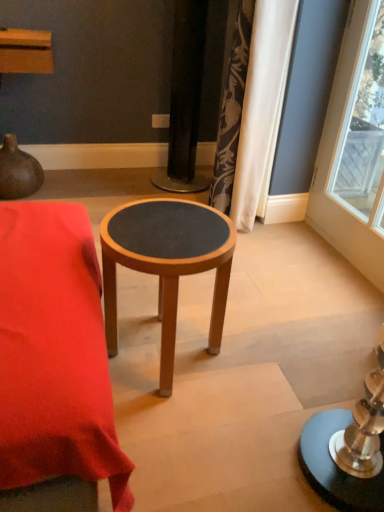
The height and width of the screenshot is (512, 384). I want to click on vacant space in wooden stool at center (from a real-world perspective), so (177, 348).